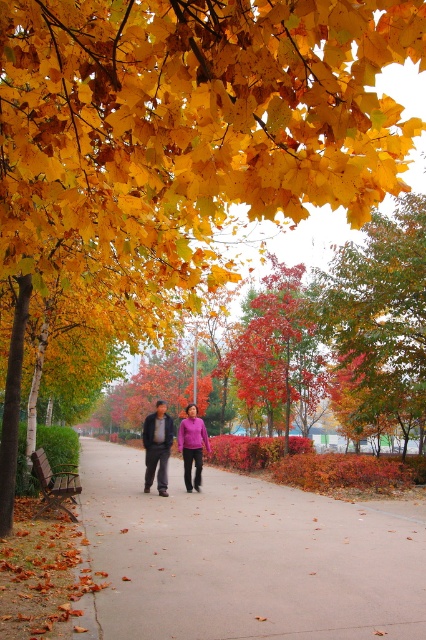
Can you confirm if green leafy tree at upper right is positioned to the left of matte purple sweater at center?

Incorrect, green leafy tree at upper right is not on the left side of matte purple sweater at center.

Does point (423, 291) lie in front of point (180, 440)?

No, (423, 291) is further to viewer.

At what (x,y) coordinates should I click in order to perform the action: click on green leafy tree at upper right. Please return your answer as a coordinate pair (x, y). The width and height of the screenshot is (426, 640). Looking at the image, I should click on (379, 323).

Is green leafy tree at upper right closer to the viewer compared to dark gray fabric jacket at center?

That is False.

Can you confirm if green leafy tree at upper right is positioned above dark gray fabric jacket at center?

Yes.

The width and height of the screenshot is (426, 640). Identify the location of green leafy tree at upper right. (379, 323).

Does shiny red leaves at center appear over purple matte shirt at center?

Yes.

Is shiny red leaves at center to the right of purple matte shirt at center from the viewer's perspective?

Indeed, shiny red leaves at center is positioned on the right side of purple matte shirt at center.

Is point (302, 378) in front of point (198, 442)?

No, it is not.

This screenshot has width=426, height=640. I want to click on shiny red leaves at center, so click(278, 353).